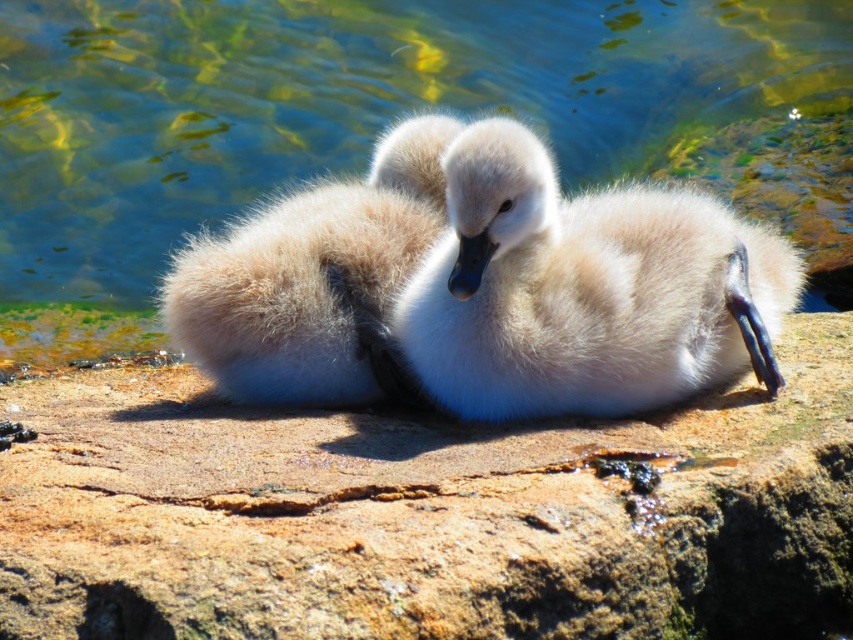
Does translucent water at center appear on the right side of white fluffy duckling at center?

Incorrect, translucent water at center is not on the right side of white fluffy duckling at center.

Is translucent water at center bigger than white fluffy duckling at center?

Correct, translucent water at center is larger in size than white fluffy duckling at center.

Does point (250, 179) come farther from viewer compared to point (573, 340)?

Yes, point (250, 179) is farther from viewer.

What are the coordinates of `translucent water at center` in the screenshot? It's located at (378, 122).

Based on the photo, which of these two, brown rough stone at center or white fluffy duckling at center, stands taller?

Standing taller between the two is white fluffy duckling at center.

Does brown rough stone at center appear on the right side of white fluffy duckling at center?

In fact, brown rough stone at center is to the left of white fluffy duckling at center.

Is point (798, 468) positioned after point (518, 371)?

No, it is not.

The height and width of the screenshot is (640, 853). Find the location of `brown rough stone at center`. brown rough stone at center is located at coordinates (428, 515).

Does white fluffy duckling at center have a lesser width compared to fluffy white goose at center?

No.

Between point (773, 369) and point (218, 259), which one is positioned in front?

Positioned in front is point (773, 369).

Which is in front, point (766, 362) or point (376, 173)?

Point (766, 362)

In order to click on white fluffy duckling at center in this screenshot , I will do `click(584, 289)`.